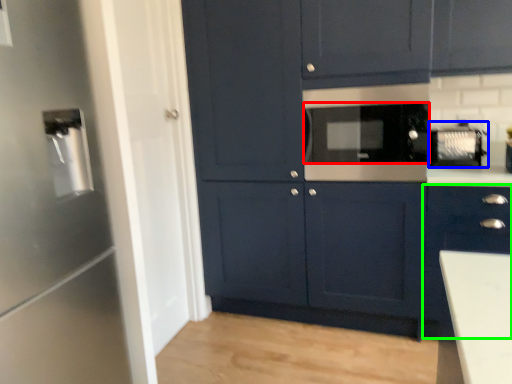
Question: Which object is the closest to the appliance (highlighted by a red box)? Choose among these: appliance (highlighted by a blue box) or cabinetry (highlighted by a green box).

Choices:
 (A) appliance
 (B) cabinetry

Answer: (A)